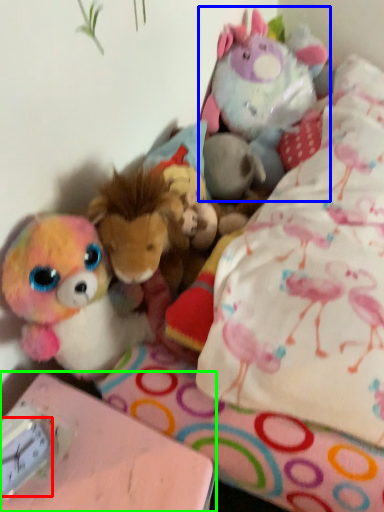
Question: Which object is positioned farthest from clock (highlighted by a red box)? Select from toy (highlighted by a blue box) and table (highlighted by a green box).

Choices:
 (A) toy
 (B) table

Answer: (A)